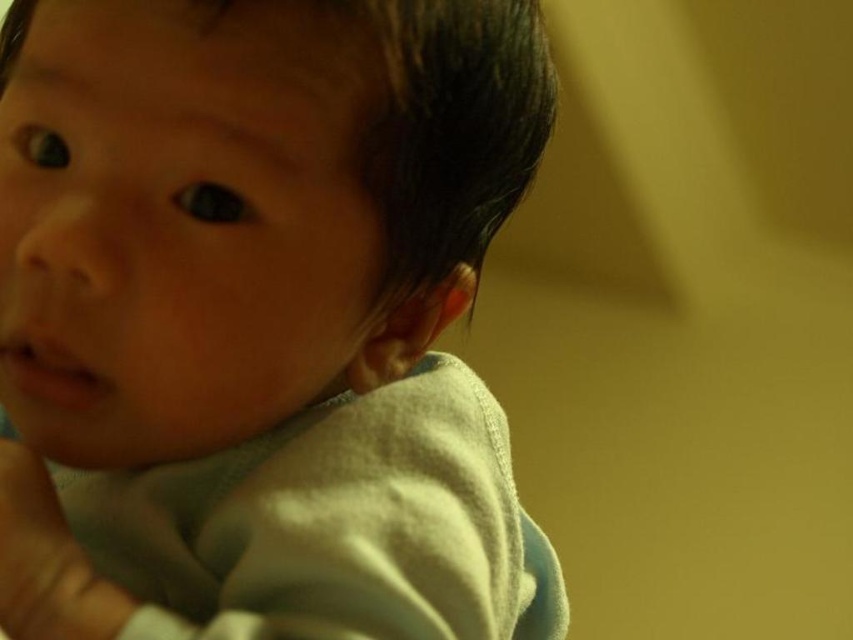
Based on the coordinates provided in the scene description, can you determine the exact location of the smooth skin baby at center?

The smooth skin baby at center is located at the coordinates point (260, 320).

Consider the image. You are a photographer trying to capture a closeup of the smooth skin baby at center and the white soft hand at lower left. Which object is in focus according to the image?

The smooth skin baby at center is closer to the viewer than the white soft hand at lower left, so the smooth skin baby at center is in focus.

You are a photographer adjusting the focus on a camera. The image shows a baby with smooth skin at the center. The focus point is set to point (260,320). Is the focus correctly placed on the baby?

The smooth skin baby at center is represented by point (260,320), so the focus is correctly placed on the baby.